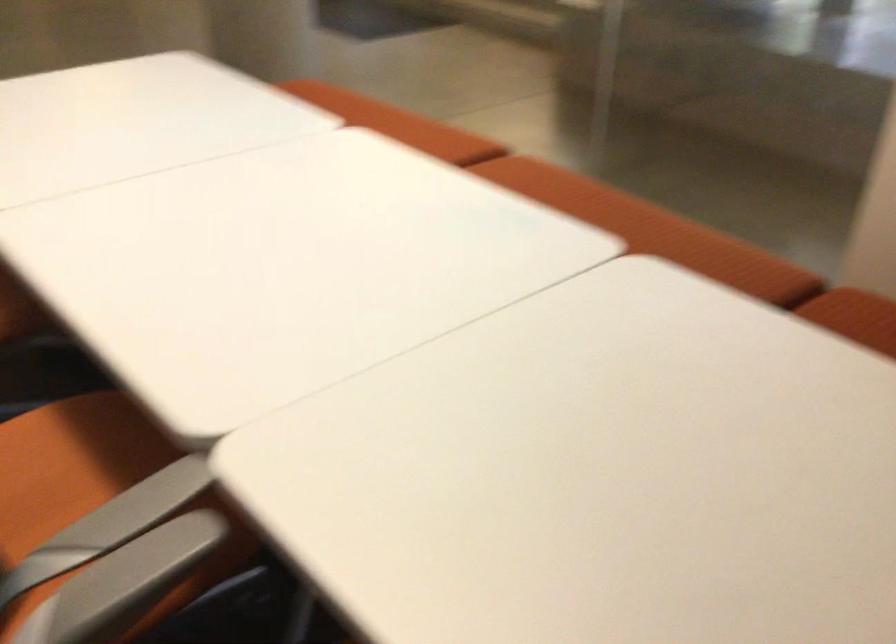
Question: The camera is either moving clockwise (left) or counter-clockwise (right) around the object. The first image is from the beginning of the video and the second image is from the end. Is the camera moving left or right when shooting the video?

Choices:
 (A) Left
 (B) Right

Answer: (B)